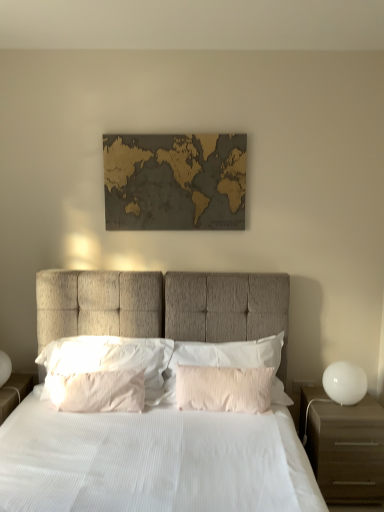
Locate an element on the screen. The width and height of the screenshot is (384, 512). pearly white satin pillow at center, arranged as the 3th pillow when viewed from the left is located at coordinates (224, 388).

What is the approximate width of pearly white satin pillow at center, the second pillow viewed from the right?

pearly white satin pillow at center, the second pillow viewed from the right, is 6.81 inches in width.

How much space does pink textured pillow at center, marked as the 4th pillow in a left-to-right arrangement, occupy horizontally?

It is 7.42 inches.

Locate an element on the screen. white fabric bed at center is located at coordinates (153, 461).

You are a GUI agent. You are given a task and a screenshot of the screen. Output one action in this format:
    pyautogui.click(x=<x>, y=<y>)
    Task: Click on the white glossy sphere at right
    The width and height of the screenshot is (384, 512).
    Given the screenshot: What is the action you would take?
    pyautogui.click(x=344, y=383)

What is the approximate width of brown matte nightstand at right?

brown matte nightstand at right is 18.28 inches in width.

You are a GUI agent. You are given a task and a screenshot of the screen. Output one action in this format:
    pyautogui.click(x=<x>, y=<y>)
    Task: Click on the pearly white satin pillow at center, arranged as the 3th pillow when viewed from the left
    
    Given the screenshot: What is the action you would take?
    pyautogui.click(x=224, y=388)

Considering the relative positions of wooden map at center and white soft pillow at center, the 4th pillow in the right-to-left sequence, in the image provided, is wooden map at center to the left or to the right of white soft pillow at center, the 4th pillow in the right-to-left sequence,?

In the image, wooden map at center appears on the right side of white soft pillow at center, the 4th pillow in the right-to-left sequence.

Does wooden map at center have a lesser height compared to white soft pillow at center, the 4th pillow in the right-to-left sequence?

No, wooden map at center is not shorter than white soft pillow at center, the 4th pillow in the right-to-left sequence.

From a real-world perspective, who is located lower, wooden map at center or white soft pillow at center, the 4th pillow in the right-to-left sequence?

white soft pillow at center, the 4th pillow in the right-to-left sequence.

Considering the points (117, 350) and (179, 385), which point is in front, point (117, 350) or point (179, 385)?

The point (179, 385) is closer.

Is white soft pillow at center, which is the 1th pillow in left-to-right order, far away from pearly white satin pillow at center, arranged as the 3th pillow when viewed from the left?

No, white soft pillow at center, which is the 1th pillow in left-to-right order, is in close proximity to pearly white satin pillow at center, arranged as the 3th pillow when viewed from the left.

Is white soft pillow at center, which is the 1th pillow in left-to-right order, taller or shorter than pearly white satin pillow at center, arranged as the 3th pillow when viewed from the left?

white soft pillow at center, which is the 1th pillow in left-to-right order, is taller than pearly white satin pillow at center, arranged as the 3th pillow when viewed from the left.

From a real-world perspective, count 1st pillows downward from the white soft pillow at center, which is the 1th pillow in left-to-right order, and point to it. Please provide its 2D coordinates.

[(224, 388)]

Is point (54, 368) farther from viewer compared to point (344, 415)?

Yes, point (54, 368) is farther from viewer.

Is white soft pillow at center, the 4th pillow in the right-to-left sequence, at the right side of brown matte nightstand at right?

No, white soft pillow at center, the 4th pillow in the right-to-left sequence, is not to the right of brown matte nightstand at right.

Considering the relative sizes of white soft pillow at center, the 4th pillow in the right-to-left sequence, and brown matte nightstand at right in the image provided, is white soft pillow at center, the 4th pillow in the right-to-left sequence, shorter than brown matte nightstand at right?

Correct, white soft pillow at center, the 4th pillow in the right-to-left sequence, is not as tall as brown matte nightstand at right.

From a real-world perspective, which is physically above, white soft pillow at center, which is the 1th pillow in left-to-right order, or brown matte nightstand at right?

white soft pillow at center, which is the 1th pillow in left-to-right order, is physically above.

Between pearly white satin pillow at center, the second pillow viewed from the right, and wooden map at center, which one has smaller width?

wooden map at center is thinner.

Is pearly white satin pillow at center, arranged as the 3th pillow when viewed from the left, facing away from wooden map at center?

pearly white satin pillow at center, arranged as the 3th pillow when viewed from the left, is not turned away from wooden map at center.

Would you say pearly white satin pillow at center, the second pillow viewed from the right, is outside wooden map at center?

Absolutely, pearly white satin pillow at center, the second pillow viewed from the right, is external to wooden map at center.

Is pearly white satin pillow at center, the second pillow viewed from the right, shorter than wooden map at center?

Indeed, pearly white satin pillow at center, the second pillow viewed from the right, has a lesser height compared to wooden map at center.

Is wooden map at center oriented away from white fabric bed at center?

No, wooden map at center's orientation is not away from white fabric bed at center.

From a real-world perspective, is wooden map at center on white fabric bed at center?

Yes, from a real-world perspective, wooden map at center is over white fabric bed at center

Is wooden map at center to the right of white fabric bed at center from the viewer's perspective?

Yes, wooden map at center is to the right of white fabric bed at center.

In the scene shown: Would you say pink textured pillow at center, the first pillow positioned from the right, is outside brown matte nightstand at right?

That's correct, pink textured pillow at center, the first pillow positioned from the right, is outside of brown matte nightstand at right.

From their relative heights in the image, would you say pink textured pillow at center, marked as the 4th pillow in a left-to-right arrangement, is taller or shorter than brown matte nightstand at right?

Considering their sizes, pink textured pillow at center, marked as the 4th pillow in a left-to-right arrangement, has less height than brown matte nightstand at right.

This screenshot has width=384, height=512. Find the location of `nightstand below the pink textured pillow at center, the first pillow positioned from the right (from the image's perspective)`. nightstand below the pink textured pillow at center, the first pillow positioned from the right (from the image's perspective) is located at coordinates (344, 447).

Does pink textured pillow at center, the first pillow positioned from the right, appear on the right side of brown matte nightstand at right?

Incorrect, pink textured pillow at center, the first pillow positioned from the right, is not on the right side of brown matte nightstand at right.

In the scene shown: From a real-world perspective, does white soft pillow at center, the 4th pillow in the right-to-left sequence, sit lower than wooden map at center?

Correct, in the physical world, white soft pillow at center, the 4th pillow in the right-to-left sequence, is lower than wooden map at center.

Which object is closer to the camera taking this photo, white soft pillow at center, the 4th pillow in the right-to-left sequence, or wooden map at center?

Positioned in front is white soft pillow at center, the 4th pillow in the right-to-left sequence.

Consider the image. Is white soft pillow at center, which is the 1th pillow in left-to-right order, situated inside wooden map at center or outside?

white soft pillow at center, which is the 1th pillow in left-to-right order, is not enclosed by wooden map at center.

From the image's perspective, does white soft pillow at center, the 4th pillow in the right-to-left sequence, appear higher than wooden map at center?

Incorrect, from the image's perspective, white soft pillow at center, the 4th pillow in the right-to-left sequence, is lower than wooden map at center.

Where is `picture frame on the right of white soft pillow at center, which is the 1th pillow in left-to-right order`? This screenshot has width=384, height=512. picture frame on the right of white soft pillow at center, which is the 1th pillow in left-to-right order is located at coordinates (175, 181).

I want to click on the 1st pillow directly beneath the white soft pillow at center, the 4th pillow in the right-to-left sequence (from a real-world perspective), so click(x=224, y=388).

When comparing their distances from pink textured pillow at center, which appears as the third pillow when viewed from the right, does wooden map at center or white fabric bed at center seem closer?

Based on the image, white fabric bed at center appears to be nearer to pink textured pillow at center, which appears as the third pillow when viewed from the right.

From the image, which object appears to be nearer to white fabric bed at center, pink textured pillow at center, positioned as the 2th pillow in left-to-right order, or wooden map at center?

The object closer to white fabric bed at center is pink textured pillow at center, positioned as the 2th pillow in left-to-right order.

Based on their spatial positions, is brown matte nightstand at right or pearly white satin pillow at center, the second pillow viewed from the right, closer to pink textured pillow at center, positioned as the 2th pillow in left-to-right order?

pearly white satin pillow at center, the second pillow viewed from the right, is positioned closer to the anchor pink textured pillow at center, positioned as the 2th pillow in left-to-right order.

When comparing their distances from brown matte nightstand at right, does wooden map at center or white fabric bed at center seem closer?

The object closer to brown matte nightstand at right is white fabric bed at center.

From the image, which object appears to be farther from pearly white satin pillow at center, the second pillow viewed from the right, pink textured pillow at center, positioned as the 2th pillow in left-to-right order, or white soft pillow at center, the 4th pillow in the right-to-left sequence?

The object further to pearly white satin pillow at center, the second pillow viewed from the right, is pink textured pillow at center, positioned as the 2th pillow in left-to-right order.

Based on their spatial positions, is white fabric bed at center or pink textured pillow at center, marked as the 4th pillow in a left-to-right arrangement, further from wooden map at center?

Among the two, white fabric bed at center is located further to wooden map at center.

Looking at this image, estimate the real-world distances between objects in this image. Which object is closer to white glossy sphere at right, brown matte nightstand at right or pearly white satin pillow at center, arranged as the 3th pillow when viewed from the left?

Based on the image, brown matte nightstand at right appears to be nearer to white glossy sphere at right.

Based on their spatial positions, is pearly white satin pillow at center, arranged as the 3th pillow when viewed from the left, or white soft pillow at center, which is the 1th pillow in left-to-right order, closer to wooden map at center?

Based on the image, white soft pillow at center, which is the 1th pillow in left-to-right order, appears to be nearer to wooden map at center.

Where is `picture frame between white soft pillow at center, which is the 1th pillow in left-to-right order, and white glossy sphere at right, in the horizontal direction`? This screenshot has width=384, height=512. picture frame between white soft pillow at center, which is the 1th pillow in left-to-right order, and white glossy sphere at right, in the horizontal direction is located at coordinates (175, 181).

This screenshot has height=512, width=384. In order to click on pillow between white soft pillow at center, the 4th pillow in the right-to-left sequence, and pearly white satin pillow at center, the second pillow viewed from the right in this screenshot , I will do `click(98, 391)`.

What are the coordinates of `pillow between white fabric bed at center and pink textured pillow at center, which appears as the third pillow when viewed from the right, from front to back` in the screenshot? It's located at (224, 388).

The height and width of the screenshot is (512, 384). I want to click on pillow between wooden map at center and white soft pillow at center, which is the 1th pillow in left-to-right order, in the vertical direction, so click(221, 358).